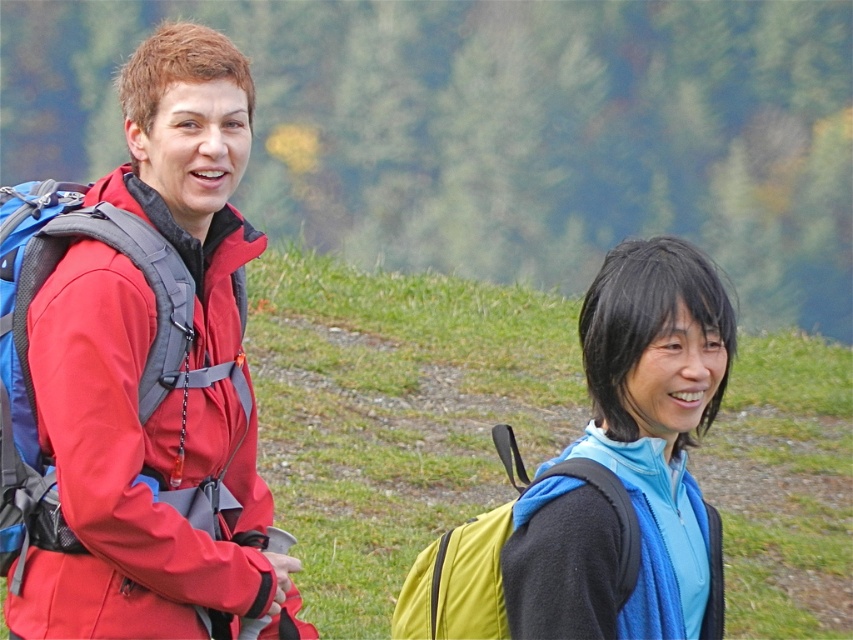
You are planning to take a photo of the matte red jacket at left and the yellow fabric backpack at lower right. Which object should you focus on first to ensure both are in the frame?

The matte red jacket at left is positioned over the yellow fabric backpack at lower right, so you should focus on the matte red jacket at left first to ensure both are in the frame.

You are a hiker who wants to take a photo of both the blue fleece jacket at right and the yellow fabric backpack at lower right in the same frame. Based on their positions, which one should you focus on first to ensure both are in the shot?

The blue fleece jacket at right is in front of the yellow fabric backpack at lower right, so you should focus on the blue fleece jacket at right first to ensure both are in the shot.